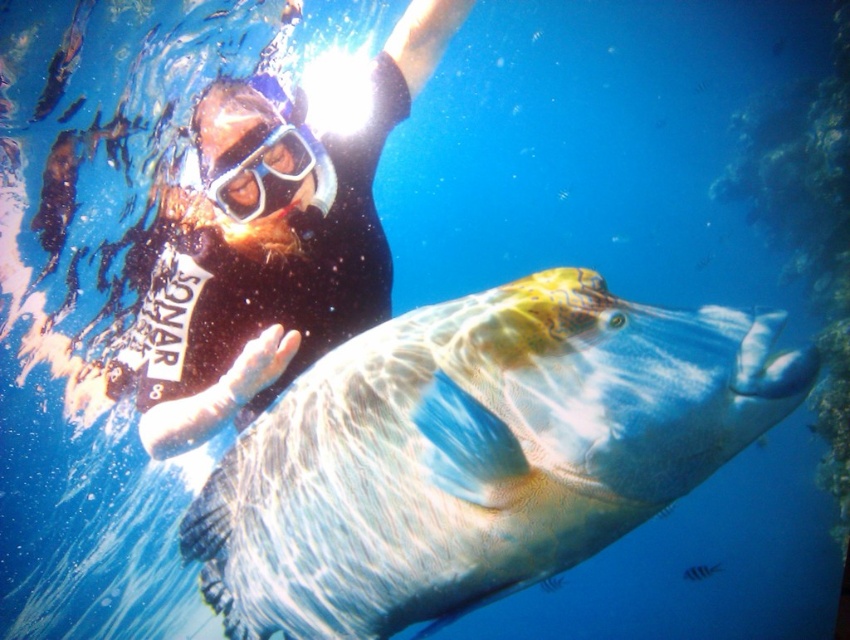
Question: Estimate the real-world distances between objects in this image. Which object is farther from the translucent blue fish at center?

Choices:
 (A) transparent plastic goggles at center
 (B) matte black snorkel gear at upper center

Answer: (A)

Question: Which of the following is the closest to the observer?

Choices:
 (A) (400, 576)
 (B) (366, 138)

Answer: (A)

Question: Which point is farther to the camera?

Choices:
 (A) (605, 396)
 (B) (332, 342)
 (C) (211, 180)

Answer: (B)

Question: Is translucent blue fish at center closer to camera compared to matte black snorkel gear at upper center?

Choices:
 (A) no
 (B) yes

Answer: (B)

Question: In this image, where is translucent blue fish at center located relative to transparent plastic goggles at center?

Choices:
 (A) left
 (B) right

Answer: (B)

Question: Can you confirm if translucent blue fish at center is positioned to the left of transparent plastic goggles at center?

Choices:
 (A) no
 (B) yes

Answer: (A)